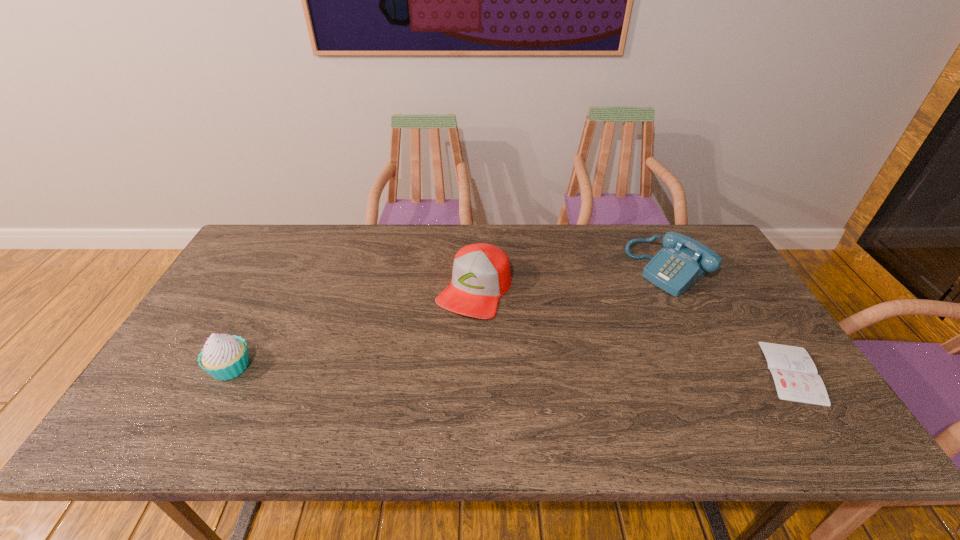
Locate an element on the screen. object situated at the far right corner is located at coordinates (683, 261).

Find the location of a particular element. Image resolution: width=960 pixels, height=540 pixels. object situated at the near right corner is located at coordinates (795, 375).

This screenshot has width=960, height=540. I want to click on vacant region at the far edge of the desktop, so click(x=542, y=241).

In the image, there is a desktop. Where is `vacant space at the near edge`? Image resolution: width=960 pixels, height=540 pixels. vacant space at the near edge is located at coordinates (553, 388).

The image size is (960, 540). I want to click on blank area at the right edge, so click(x=702, y=288).

Identify the location of vacant space at the near right corner. (751, 383).

Locate an element on the screen. vacant area that lies between the baseball cap and the diary is located at coordinates (634, 330).

This screenshot has height=540, width=960. I want to click on vacant region between the telephone and the baseball cap, so click(571, 279).

I want to click on free area in between the diary and the telephone, so 731,320.

Identify the location of free area in between the shortest object and the leftmost object. (512, 369).